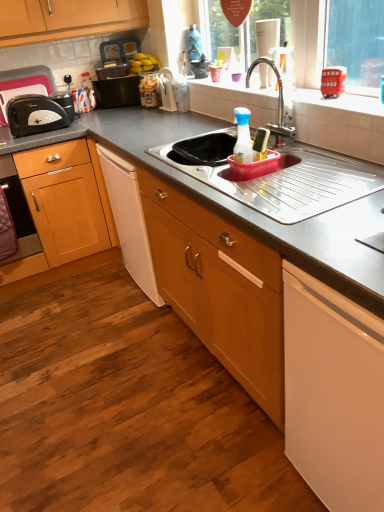
Locate an element on the screen. vacant region above white ceramic window sill at upper center (from a real-world perspective) is located at coordinates (300, 94).